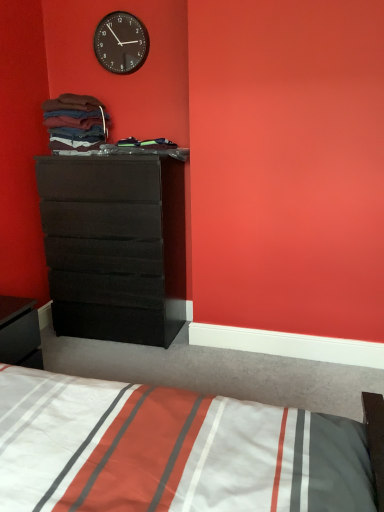
Question: From the image's perspective, is matte black dresser at left located above or below white striped fabric at lower center?

Choices:
 (A) above
 (B) below

Answer: (A)

Question: Relative to white striped fabric at lower center, is matte black dresser at left in front or behind?

Choices:
 (A) front
 (B) behind

Answer: (B)

Question: Estimate the real-world distances between objects in this image. Which object is closer to the black glossy nightstand at lower left?

Choices:
 (A) matte black dresser at left
 (B) multicolored fabric at upper left
 (C) black plastic wall clock at upper center
 (D) white striped fabric at lower center

Answer: (A)

Question: Estimate the real-world distances between objects in this image. Which object is farther from the matte black dresser at left?

Choices:
 (A) black plastic wall clock at upper center
 (B) multicolored fabric at upper left
 (C) black glossy nightstand at lower left
 (D) white striped fabric at lower center

Answer: (D)